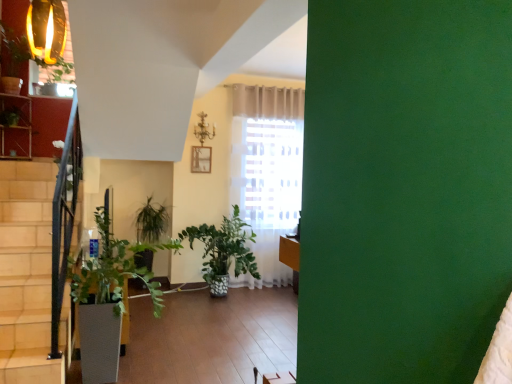
Question: Does white textured flowerpot at lower left lie behind green glossy plant at lower center?

Choices:
 (A) yes
 (B) no

Answer: (A)

Question: From a real-world perspective, is white textured flowerpot at lower left beneath green glossy plant at lower center?

Choices:
 (A) yes
 (B) no

Answer: (A)

Question: Is white textured flowerpot at lower left wider than green glossy plant at lower center?

Choices:
 (A) yes
 (B) no

Answer: (B)

Question: Can you confirm if white textured flowerpot at lower left is smaller than green glossy plant at lower center?

Choices:
 (A) yes
 (B) no

Answer: (A)

Question: Is white textured flowerpot at lower left surrounding green glossy plant at lower center?

Choices:
 (A) no
 (B) yes

Answer: (A)

Question: Is white textured flowerpot at lower left aimed at green glossy plant at lower center?

Choices:
 (A) yes
 (B) no

Answer: (B)

Question: Does green glossy plant at lower center have a larger size compared to white textured flowerpot at lower left?

Choices:
 (A) no
 (B) yes

Answer: (B)

Question: Is green glossy plant at lower center located outside white textured flowerpot at lower left?

Choices:
 (A) yes
 (B) no

Answer: (A)

Question: Can you confirm if green glossy plant at lower center is positioned to the right of white textured flowerpot at lower left?

Choices:
 (A) no
 (B) yes

Answer: (B)

Question: From the image's perspective, is green glossy plant at lower center on top of white textured flowerpot at lower left?

Choices:
 (A) no
 (B) yes

Answer: (B)

Question: Can you confirm if green glossy plant at lower center is taller than white textured flowerpot at lower left?

Choices:
 (A) no
 (B) yes

Answer: (B)

Question: From the image's perspective, is green glossy plant at lower center located beneath white textured flowerpot at lower left?

Choices:
 (A) no
 (B) yes

Answer: (A)

Question: From a real-world perspective, is green glossy plant at lower center above or below white textured flowerpot at lower left?

Choices:
 (A) below
 (B) above

Answer: (B)